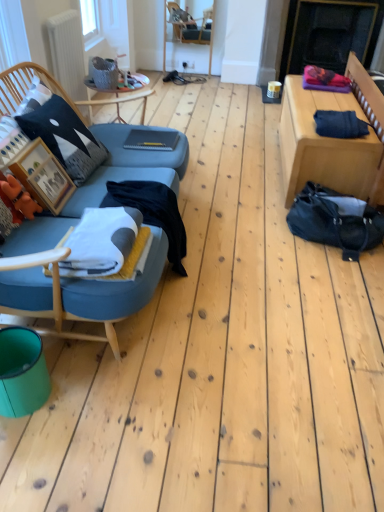
Question: From the image's perspective, is wooden chair at center located beneath wooden picture frame at left?

Choices:
 (A) no
 (B) yes

Answer: (A)

Question: Does wooden chair at center have a larger size compared to wooden picture frame at left?

Choices:
 (A) yes
 (B) no

Answer: (A)

Question: Considering the relative sizes of wooden chair at center and wooden picture frame at left in the image provided, is wooden chair at center taller than wooden picture frame at left?

Choices:
 (A) yes
 (B) no

Answer: (A)

Question: Is wooden picture frame at left a part of wooden chair at center?

Choices:
 (A) yes
 (B) no

Answer: (B)

Question: Can you confirm if wooden chair at center is positioned to the right of wooden picture frame at left?

Choices:
 (A) yes
 (B) no

Answer: (A)

Question: Is white soft blanket at center wider or thinner than matte black pillow at left?

Choices:
 (A) thin
 (B) wide

Answer: (B)

Question: Is white soft blanket at center to the left or to the right of matte black pillow at left in the image?

Choices:
 (A) left
 (B) right

Answer: (B)

Question: Considering the positions of point (97, 237) and point (59, 152), is point (97, 237) closer or farther from the camera than point (59, 152)?

Choices:
 (A) farther
 (B) closer

Answer: (B)

Question: From the image's perspective, relative to matte black pillow at left, is white soft blanket at center above or below?

Choices:
 (A) above
 (B) below

Answer: (B)

Question: From a real-world perspective, is teal plastic bin at lower left positioned above or below wooden chair at center?

Choices:
 (A) below
 (B) above

Answer: (A)

Question: Is teal plastic bin at lower left wider or thinner than wooden chair at center?

Choices:
 (A) wide
 (B) thin

Answer: (A)

Question: From their relative heights in the image, would you say teal plastic bin at lower left is taller or shorter than wooden chair at center?

Choices:
 (A) short
 (B) tall

Answer: (A)

Question: Considering the positions of point (6, 331) and point (208, 12), is point (6, 331) closer or farther from the camera than point (208, 12)?

Choices:
 (A) closer
 (B) farther

Answer: (A)

Question: In the image, is white soft blanket at center on the left side or the right side of wooden chair at center?

Choices:
 (A) right
 (B) left

Answer: (B)

Question: In terms of width, does white soft blanket at center look wider or thinner when compared to wooden chair at center?

Choices:
 (A) wide
 (B) thin

Answer: (A)